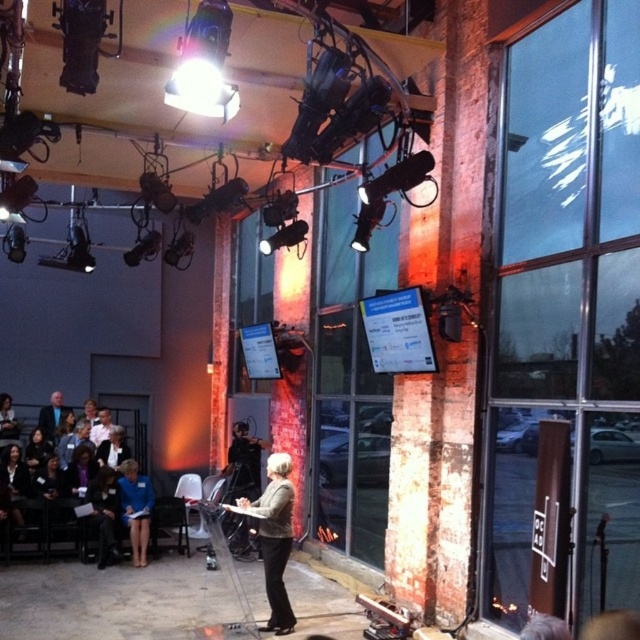
Which is in front, point (244, 508) or point (52, 433)?

Point (244, 508) is more forward.

Which is in front, point (273, 464) or point (42, 412)?

Point (273, 464)

Locate an element on the screen. The image size is (640, 640). gray wool blazer at center is located at coordinates (275, 538).

I want to click on gray wool blazer at center, so click(x=275, y=538).

Which is more to the left, gray wool blazer at center or blue fabric jacket at lower left?

From the viewer's perspective, blue fabric jacket at lower left appears more on the left side.

What do you see at coordinates (275, 538) in the screenshot? Image resolution: width=640 pixels, height=640 pixels. I see `gray wool blazer at center` at bounding box center [275, 538].

Locate an element on the screen. gray wool blazer at center is located at coordinates (275, 538).

Can you confirm if blue fabric jacket at lower left is positioned above dark blue suit at left?

No, blue fabric jacket at lower left is not above dark blue suit at left.

Who is more distant from viewer, (148, 516) or (52, 436)?

The point (52, 436) is more distant.

This screenshot has height=640, width=640. What are the coordinates of `blue fabric jacket at lower left` in the screenshot? It's located at (134, 508).